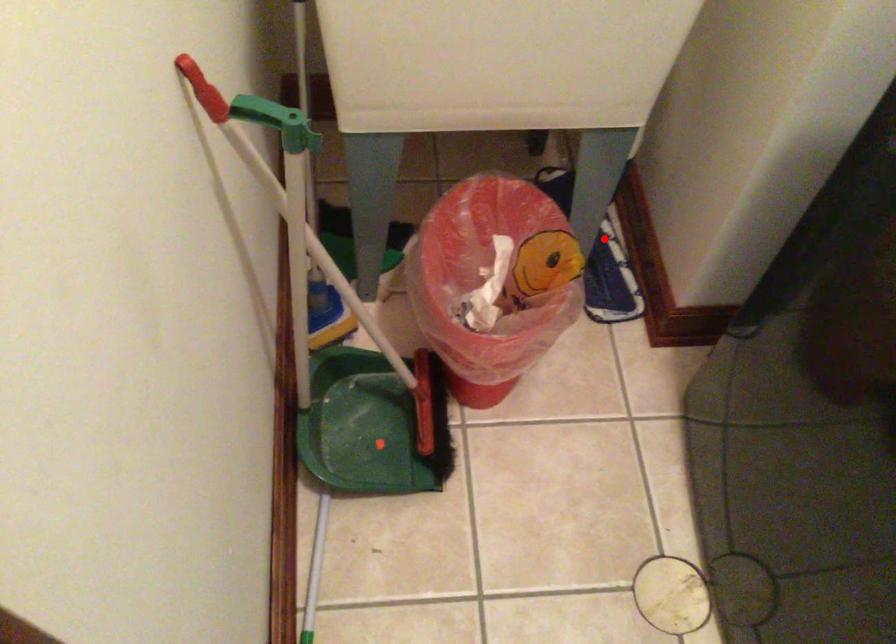
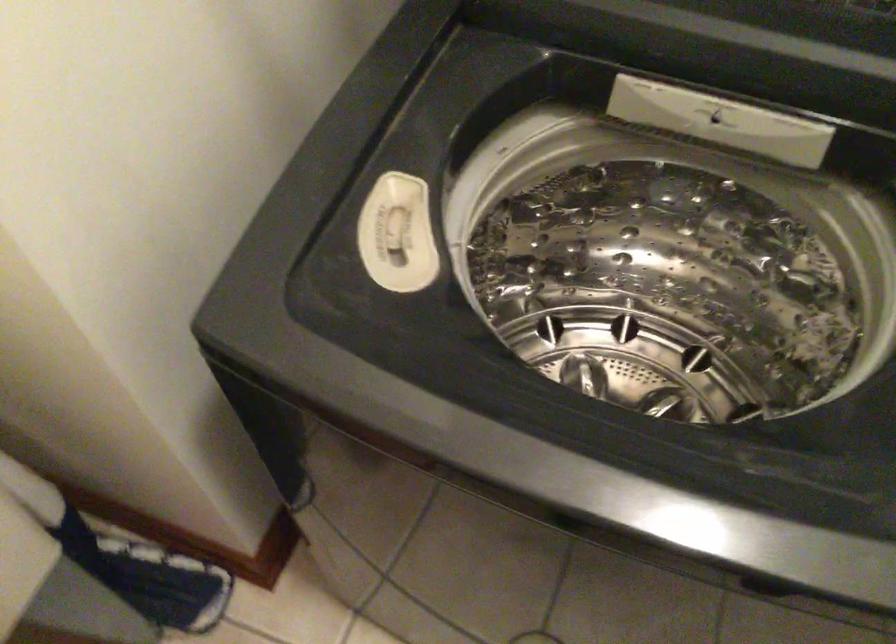
Locate, in the second image, the point that corresponds to the highlighted location in the first image.

(125, 560)